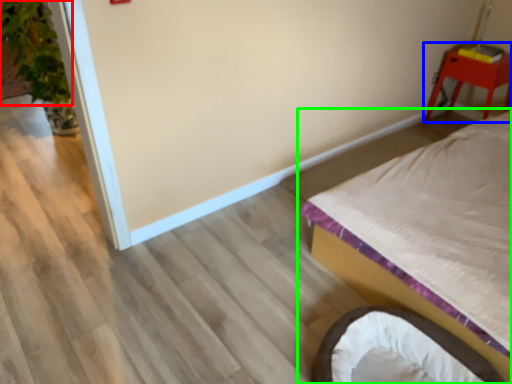
Question: Which is nearer to the plant (highlighted by a red box)? furniture (highlighted by a blue box) or bed (highlighted by a green box).

Choices:
 (A) furniture
 (B) bed

Answer: (B)